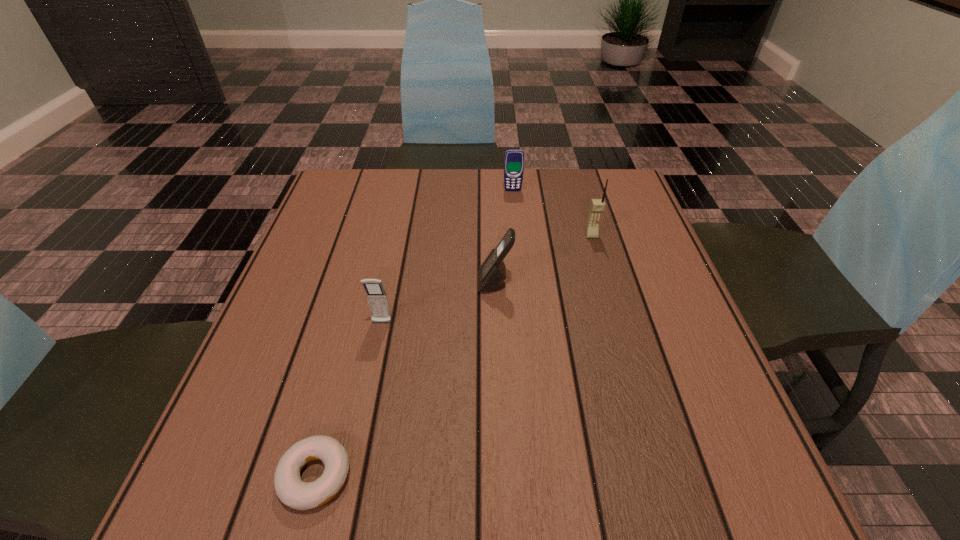
Locate an element on the screen. The width and height of the screenshot is (960, 540). vacant area between the third farthest cellular telephone and the fourth farthest object is located at coordinates (439, 303).

This screenshot has height=540, width=960. Find the location of `unoccupied position between the farthest object and the nearest cellular telephone`. unoccupied position between the farthest object and the nearest cellular telephone is located at coordinates [x=447, y=256].

Find the location of a particular element. The width and height of the screenshot is (960, 540). free spot between the second nearest cellular telephone and the doughnut is located at coordinates (405, 380).

Locate which object is the closest to the rightmost cellular telephone. Please provide its 2D coordinates. Your answer should be formatted as a tuple, i.e. [(x, y)], where the tuple contains the x and y coordinates of a point satisfying the conditions above.

[(492, 273)]

At what (x,y) coordinates should I click in order to perform the action: click on object that ranks as the second closest to the nearest cellular telephone. Please return your answer as a coordinate pair (x, y). Looking at the image, I should click on (291, 490).

Select which cellular telephone is the second closest to the leftmost cellular telephone. Please provide its 2D coordinates. Your answer should be formatted as a tuple, i.e. [(x, y)], where the tuple contains the x and y coordinates of a point satisfying the conditions above.

[(597, 206)]

In order to click on cellular telephone object that ranks as the fourth closest to the nearest object in this screenshot , I will do `click(514, 158)`.

Locate an element on the screen. blank space that satisfies the following two spatial constraints: 1. on the front-facing side of the second nearest cellular telephone; 2. on the front-facing side of the leftmost cellular telephone is located at coordinates (496, 323).

Where is `free space in the image that satisfies the following two spatial constraints: 1. on the front-facing side of the third farthest object; 2. on the front-facing side of the leftmost cellular telephone`? The width and height of the screenshot is (960, 540). free space in the image that satisfies the following two spatial constraints: 1. on the front-facing side of the third farthest object; 2. on the front-facing side of the leftmost cellular telephone is located at coordinates (496, 323).